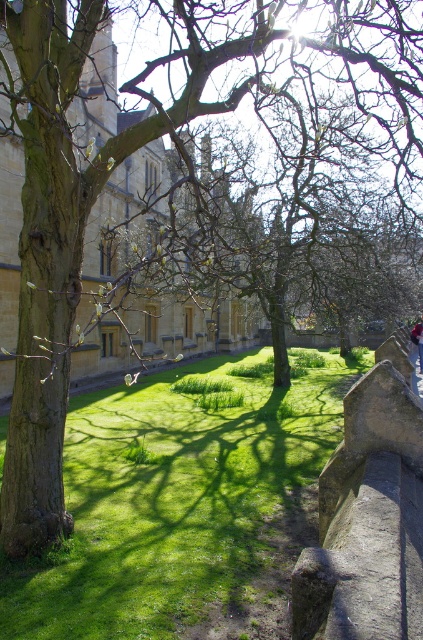
You are standing at the edge of the green grass at center and want to place the denim jacket at lower right so that it covers the entire width of the grass. Is this possible?

The green grass at center is wider than the denim jacket at lower right, so the denim jacket at lower right cannot cover the entire width of the green grass at center.